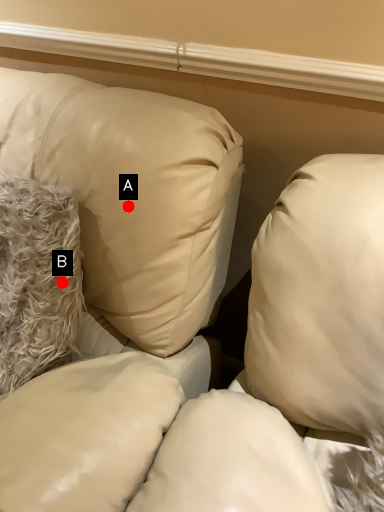
Question: Two points are circled on the image, labeled by A and B beside each circle. Which point appears farthest from the camera in this image?

Choices:
 (A) A is further
 (B) B is further

Answer: (B)